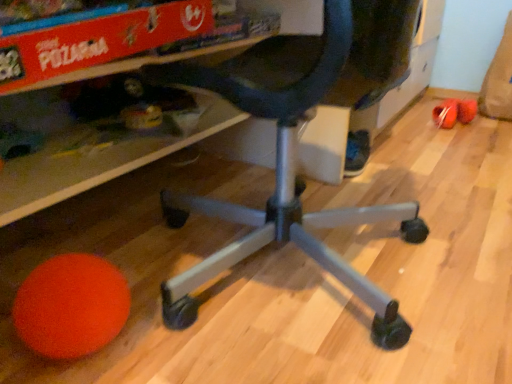
Question: Can you confirm if black matte office chair at center is smaller than orange matte ball at lower left?

Choices:
 (A) yes
 (B) no

Answer: (B)

Question: Is black matte office chair at center further to camera compared to orange matte ball at lower left?

Choices:
 (A) no
 (B) yes

Answer: (A)

Question: Can you confirm if black matte office chair at center is taller than orange matte ball at lower left?

Choices:
 (A) no
 (B) yes

Answer: (B)

Question: Is black matte office chair at center outside of orange matte ball at lower left?

Choices:
 (A) yes
 (B) no

Answer: (A)

Question: Can you confirm if black matte office chair at center is positioned to the right of orange matte ball at lower left?

Choices:
 (A) yes
 (B) no

Answer: (A)

Question: Considering their positions, is black matte office chair at center located in front of or behind rubberized plastic ball at lower left?

Choices:
 (A) front
 (B) behind

Answer: (A)

Question: Considering the positions of black matte office chair at center and rubberized plastic ball at lower left in the image, is black matte office chair at center taller or shorter than rubberized plastic ball at lower left?

Choices:
 (A) tall
 (B) short

Answer: (A)

Question: From the image's perspective, is black matte office chair at center above or below rubberized plastic ball at lower left?

Choices:
 (A) below
 (B) above

Answer: (A)

Question: Is black matte office chair at center inside or outside of rubberized plastic ball at lower left?

Choices:
 (A) inside
 (B) outside

Answer: (B)

Question: Is orange matte ball at lower left inside the boundaries of black matte office chair at center, or outside?

Choices:
 (A) inside
 (B) outside

Answer: (B)

Question: Considering the positions of orange matte ball at lower left and black matte office chair at center in the image, is orange matte ball at lower left wider or thinner than black matte office chair at center?

Choices:
 (A) thin
 (B) wide

Answer: (A)

Question: From a real-world perspective, is orange matte ball at lower left positioned above or below black matte office chair at center?

Choices:
 (A) below
 (B) above

Answer: (A)

Question: In the image, is orange matte ball at lower left positioned in front of or behind black matte office chair at center?

Choices:
 (A) front
 (B) behind

Answer: (B)

Question: In terms of size, does orange matte ball at lower left appear bigger or smaller than rubberized plastic ball at lower left?

Choices:
 (A) big
 (B) small

Answer: (A)

Question: Considering the relative positions of orange matte ball at lower left and rubberized plastic ball at lower left in the image provided, is orange matte ball at lower left to the left or to the right of rubberized plastic ball at lower left?

Choices:
 (A) right
 (B) left

Answer: (B)